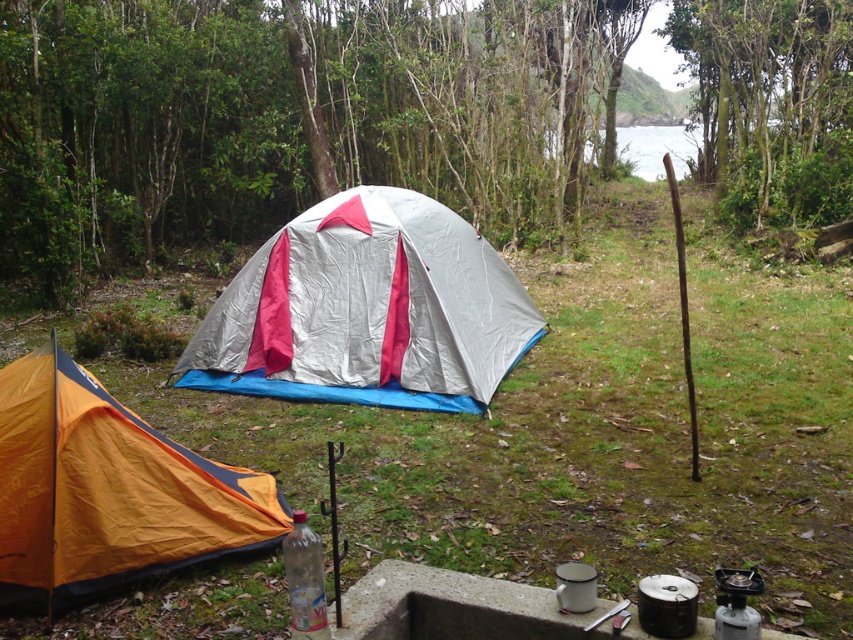
Which is behind, point (252, 292) or point (56, 353)?

Point (252, 292)

Is silver/reflective tent at center above orange nylon tent at lower left?

Yes.

I want to click on silver/reflective tent at center, so click(x=367, y=310).